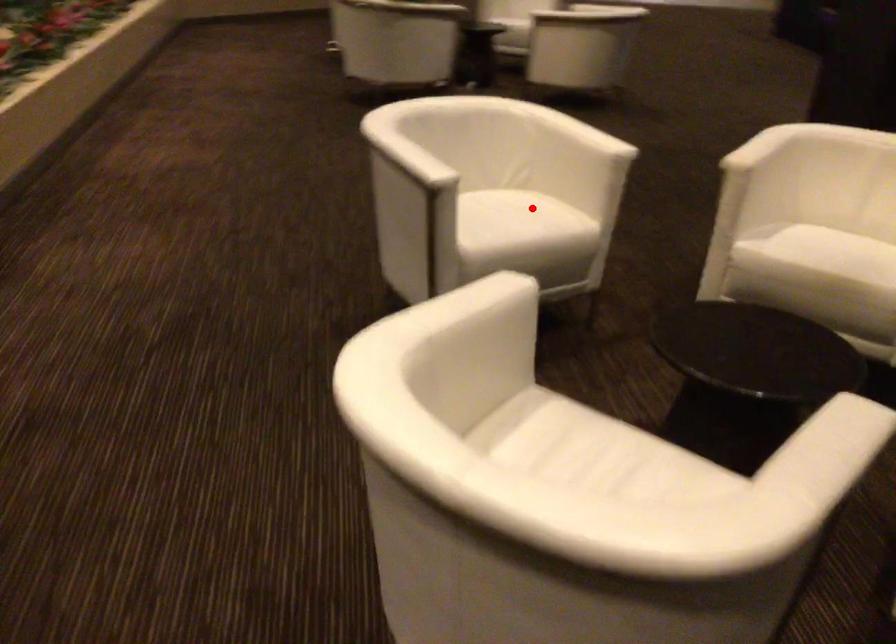
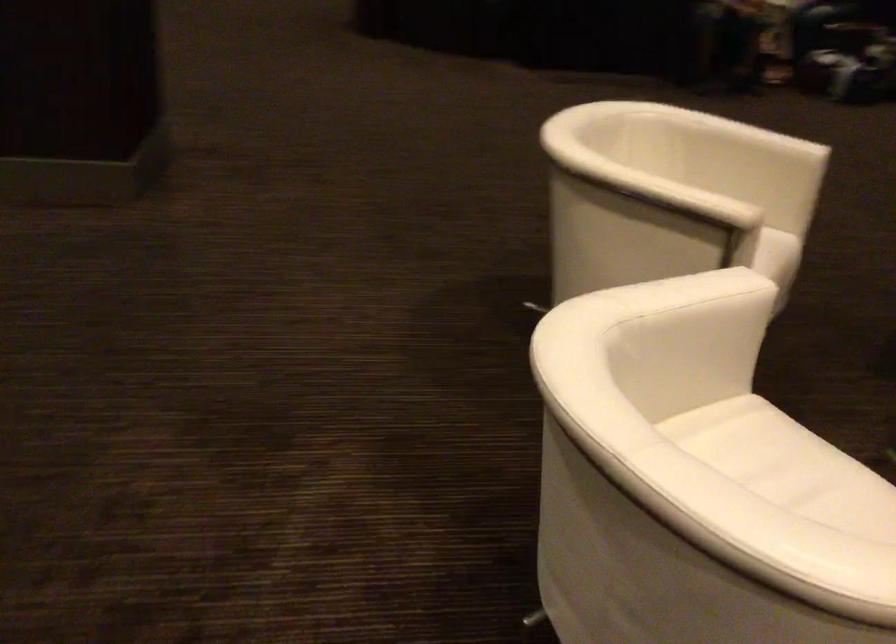
Find the pixel in the second image that matches the highlighted location in the first image.

(767, 453)